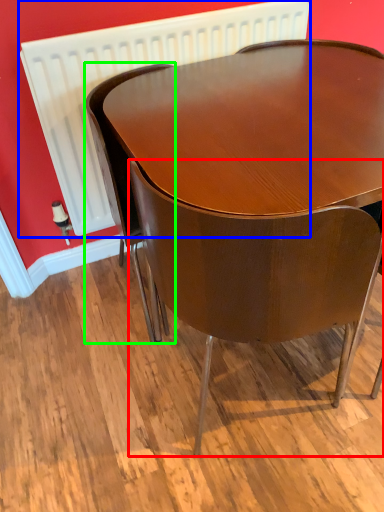
Question: Which object is the farthest from chair (highlighted by a red box)? Choose among these: radiator (highlighted by a blue box) or chair (highlighted by a green box).

Choices:
 (A) radiator
 (B) chair

Answer: (A)